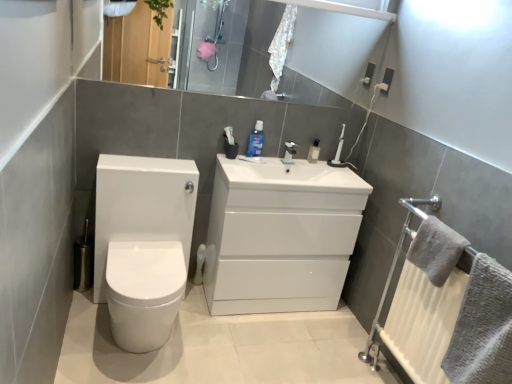
Where is `vacant region to the right of blue glossy mouthwash at center, which is counted as the second mouthwash, starting from the right`? The height and width of the screenshot is (384, 512). vacant region to the right of blue glossy mouthwash at center, which is counted as the second mouthwash, starting from the right is located at coordinates (279, 154).